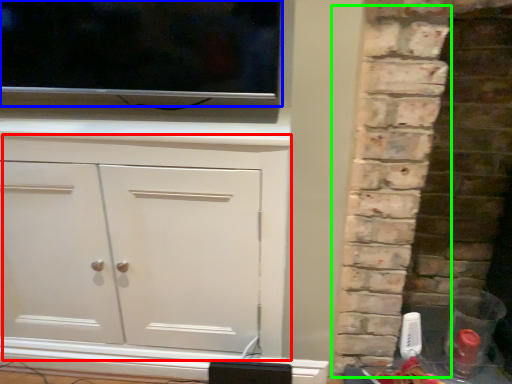
Question: Based on their relative distances, which object is farther from cupboard (highlighted by a red box)? Choose from tv show (highlighted by a blue box) and brickwork (highlighted by a green box).

Choices:
 (A) tv show
 (B) brickwork

Answer: (B)